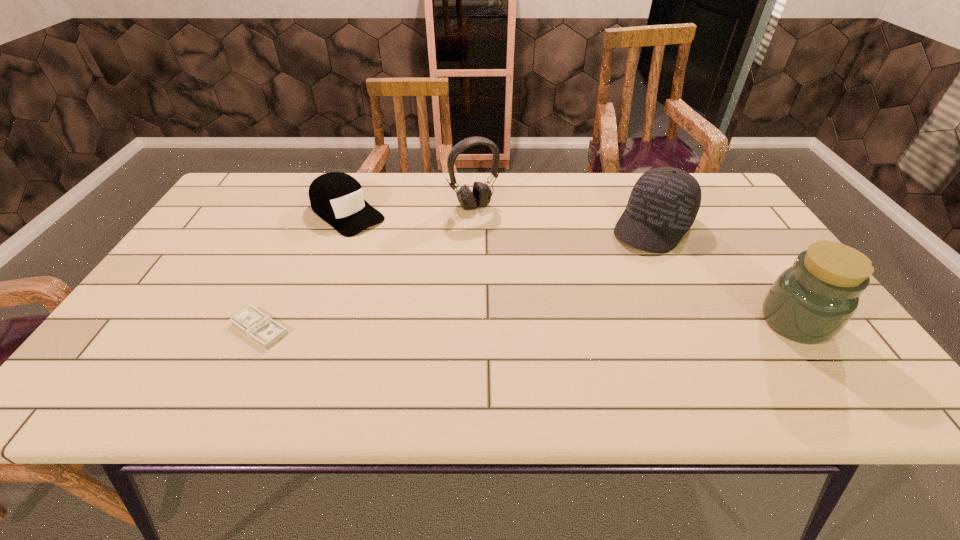
Image resolution: width=960 pixels, height=540 pixels. I want to click on free location located on the front-facing side of the third object from left to right, so pyautogui.click(x=504, y=238).

You are a GUI agent. You are given a task and a screenshot of the screen. Output one action in this format:
    pyautogui.click(x=<x>, y=<y>)
    Task: Click on the vacant position located at the front of the baseball cap where the brim is located
    Image resolution: width=960 pixels, height=540 pixels.
    Given the screenshot: What is the action you would take?
    pyautogui.click(x=606, y=286)

Image resolution: width=960 pixels, height=540 pixels. I want to click on vacant area situated at the front of the baseball cap where the brim is located, so pos(620,268).

The image size is (960, 540). I want to click on free region located 0.090m at the front of the baseball cap where the brim is located, so click(622, 266).

Identify the location of free region located 0.320m on the front-facing side of the second shortest object. (443, 287).

Find the location of `vacant space situated 0.390m on the front-facing side of the second shortest object`. vacant space situated 0.390m on the front-facing side of the second shortest object is located at coordinates (462, 302).

Where is `vacant point located on the front-facing side of the second shortest object`? The image size is (960, 540). vacant point located on the front-facing side of the second shortest object is located at coordinates (422, 272).

Where is `headset that is positioned at the far edge`? The width and height of the screenshot is (960, 540). headset that is positioned at the far edge is located at coordinates (480, 196).

At what (x,y) coordinates should I click in order to perform the action: click on baseball cap that is at the far edge. Please return your answer as a coordinate pair (x, y). The image size is (960, 540). Looking at the image, I should click on (664, 202).

Identify the location of cap that is at the far edge. The width and height of the screenshot is (960, 540). (337, 198).